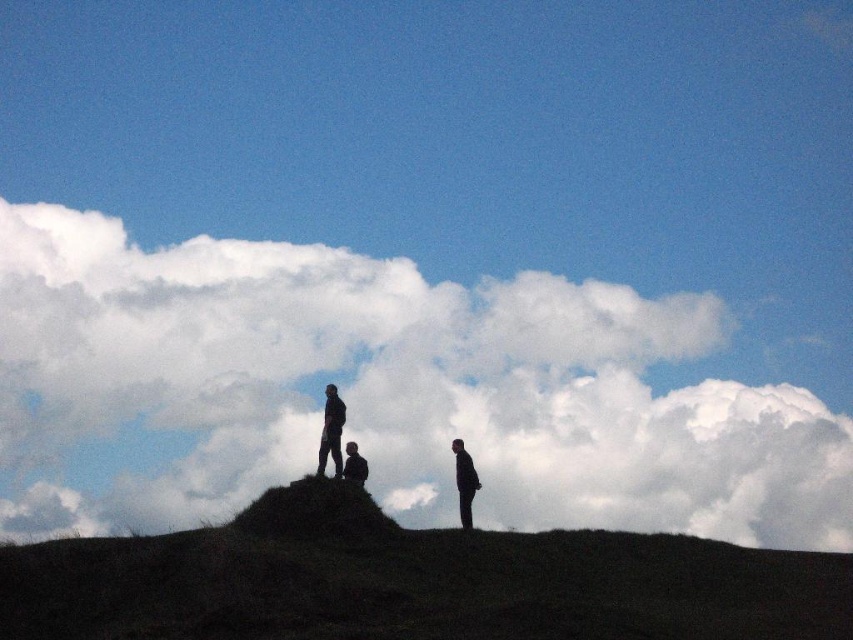
Does white fluffy cloud at upper center appear under dark gray suit at center?

Indeed, white fluffy cloud at upper center is positioned under dark gray suit at center.

Is white fluffy cloud at upper center further to the viewer compared to dark gray suit at center?

No, it is in front of dark gray suit at center.

This screenshot has height=640, width=853. Identify the location of white fluffy cloud at upper center. (386, 390).

Is point (329, 419) more distant than point (461, 516)?

Yes, it is.

Does matte black figure at center have a greater height compared to dark gray suit at center?

Indeed, matte black figure at center has a greater height compared to dark gray suit at center.

The width and height of the screenshot is (853, 640). What do you see at coordinates (331, 432) in the screenshot? I see `matte black figure at center` at bounding box center [331, 432].

Find the location of a particular element. This screenshot has height=640, width=853. matte black figure at center is located at coordinates (331, 432).

Can you confirm if white fluffy cloud at upper center is smaller than matte black figure at center?

Incorrect, white fluffy cloud at upper center is not smaller in size than matte black figure at center.

I want to click on white fluffy cloud at upper center, so click(386, 390).

Locate an element on the screen. The width and height of the screenshot is (853, 640). white fluffy cloud at upper center is located at coordinates (386, 390).